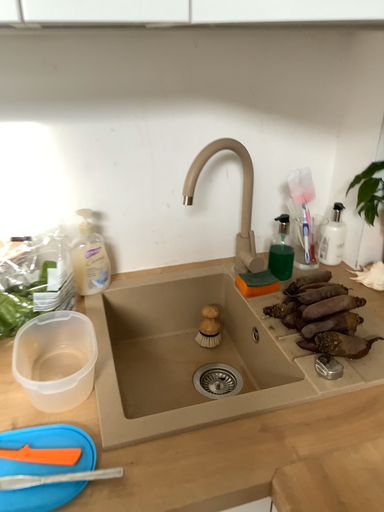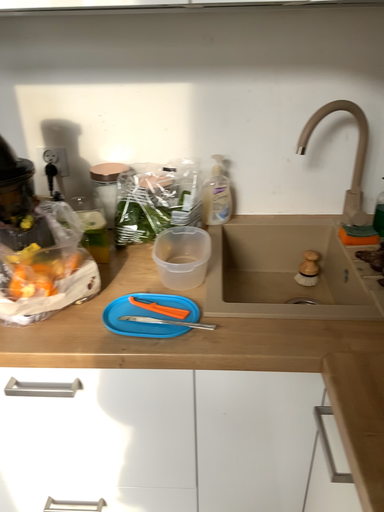
Question: How did the camera likely rotate when shooting the video?

Choices:
 (A) rotated right
 (B) rotated left

Answer: (B)